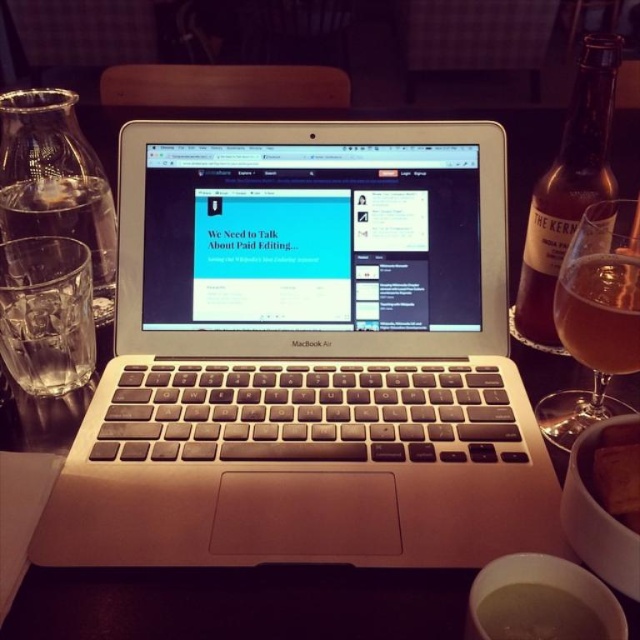
Between translucent glass wine glass at right and brown crumbly cookie at lower right, which one is positioned higher?

translucent glass wine glass at right is higher up.

Who is positioned more to the right, translucent glass wine glass at right or brown crumbly cookie at lower right?

Positioned to the right is translucent glass wine glass at right.

Is point (616, 321) positioned before point (625, 461)?

No.

Image resolution: width=640 pixels, height=640 pixels. Identify the location of translucent glass wine glass at right. (595, 316).

Does silver metallic laptop at center appear under amber glass at right?

Indeed, silver metallic laptop at center is positioned under amber glass at right.

Is point (438, 316) in front of point (592, 317)?

No, it is not.

At what (x,y) coordinates should I click in order to perform the action: click on silver metallic laptop at center. Please return your answer as a coordinate pair (x, y). The width and height of the screenshot is (640, 640). Looking at the image, I should click on (307, 356).

Is brown glass bottle at right wider than amber glass at right?

Yes, brown glass bottle at right is wider than amber glass at right.

Is point (572, 195) in front of point (636, 268)?

That is False.

Find the location of a particular element. This screenshot has height=640, width=640. brown glass bottle at right is located at coordinates (566, 189).